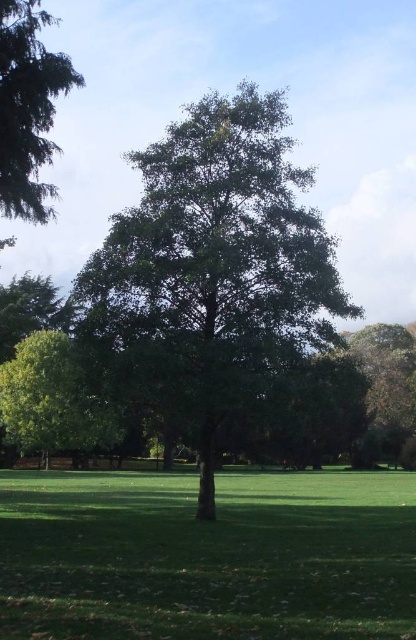
Question: Which object is positioned farthest from the green leafy tree at lower left?

Choices:
 (A) green leafy tree at right
 (B) green matte tree at upper left
 (C) green leafy tree at center
 (D) green grass at center

Answer: (A)

Question: Can you confirm if green grass at center is smaller than green leafy tree at center?

Choices:
 (A) no
 (B) yes

Answer: (B)

Question: Among these objects, which one is nearest to the camera?

Choices:
 (A) green matte tree at upper left
 (B) green leafy tree at lower left

Answer: (A)

Question: Is green grass at center below green leafy tree at lower left?

Choices:
 (A) yes
 (B) no

Answer: (A)

Question: Which of the following is the farthest from the observer?

Choices:
 (A) green leafy tree at lower left
 (B) green leafy tree at center

Answer: (A)

Question: Can you confirm if green leafy tree at lower left is wider than green leafy tree at right?

Choices:
 (A) yes
 (B) no

Answer: (B)